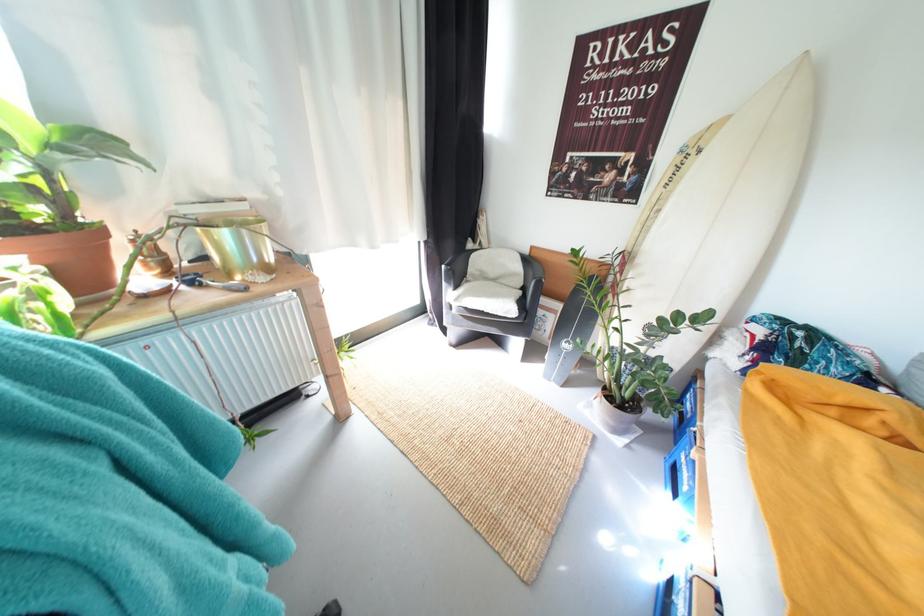
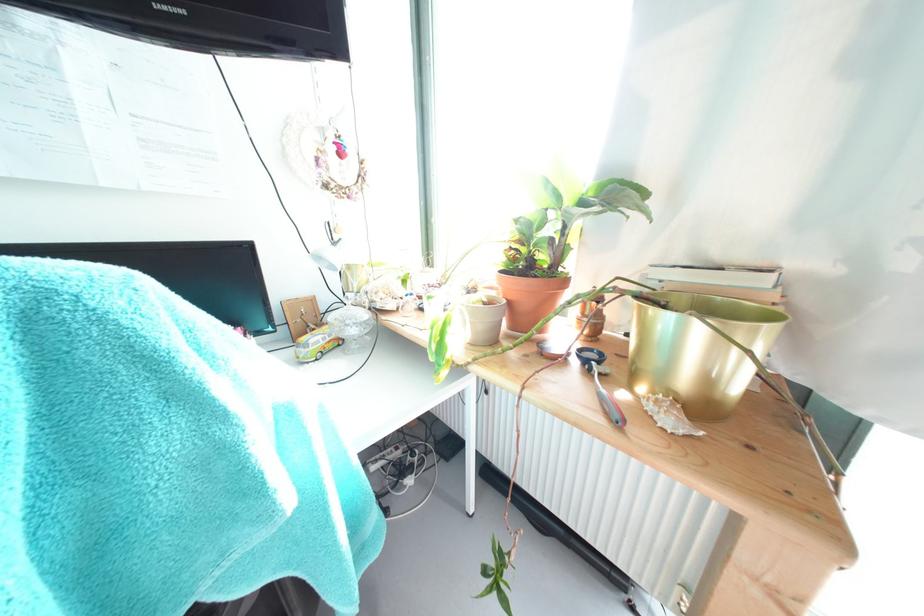
Question: The camera is either moving clockwise (left) or counter-clockwise (right) around the object. The first image is from the beginning of the video and the second image is from the end. Is the camera moving left or right when shooting the video?

Choices:
 (A) Left
 (B) Right

Answer: (B)